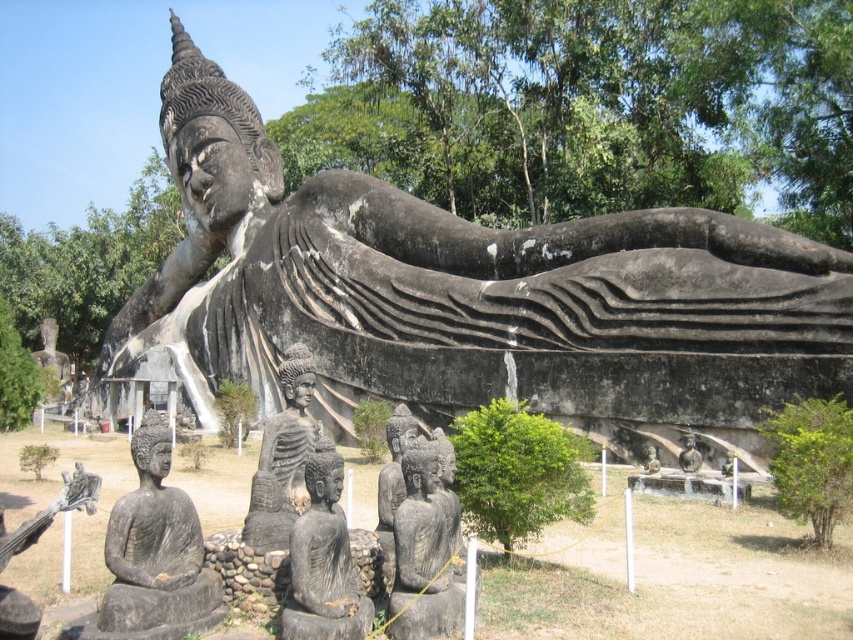
Question: Which object is the closest to the black stone reclining buddha at upper center?

Choices:
 (A) dark gray stone statue at center
 (B) black stone buddha at center
 (C) smooth gray statue at center

Answer: (B)

Question: Based on their relative distances, which object is farther from the dark gray stone statue at center?

Choices:
 (A) black stone reclining buddha at upper center
 (B) smooth stone statue at center
 (C) black stone buddha at center
 (D) black stone statue at lower left

Answer: (A)

Question: Can you confirm if black stone buddha at center is thinner than smooth stone statue at center?

Choices:
 (A) yes
 (B) no

Answer: (B)

Question: Among these objects, which one is nearest to the camera?

Choices:
 (A) smooth stone statue at center
 (B) dark gray stone statue at center
 (C) smooth gray statue at center

Answer: (B)

Question: Does black stone reclining buddha at upper center have a lesser width compared to smooth stone statue at center?

Choices:
 (A) yes
 (B) no

Answer: (B)

Question: Where is smooth gray statue at center located in relation to smooth stone statue at center in the image?

Choices:
 (A) left
 (B) right

Answer: (B)